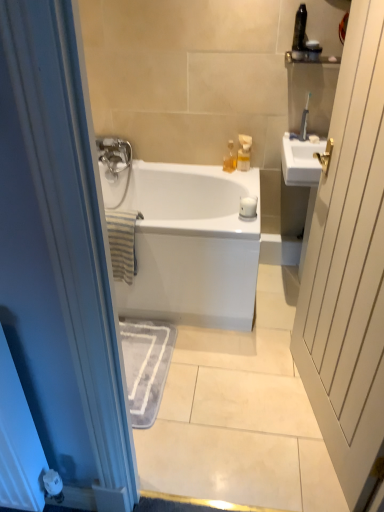
Question: From a real-world perspective, is white wood door at right below translucent plastic container at upper right, arranged as the fourth toiletry when viewed from the left?

Choices:
 (A) yes
 (B) no

Answer: (A)

Question: Does white wood door at right appear on the left side of translucent plastic container at upper right, arranged as the fourth toiletry when viewed from the left?

Choices:
 (A) yes
 (B) no

Answer: (A)

Question: Are white wood door at right and translucent plastic container at upper right, which appears as the 2th toiletry when viewed from the right, beside each other?

Choices:
 (A) no
 (B) yes

Answer: (A)

Question: Is white wood door at right positioned in front of translucent plastic container at upper right, which appears as the 2th toiletry when viewed from the right?

Choices:
 (A) no
 (B) yes

Answer: (B)

Question: Does white wood door at right have a lesser height compared to translucent plastic container at upper right, which appears as the 2th toiletry when viewed from the right?

Choices:
 (A) yes
 (B) no

Answer: (B)

Question: From the image's perspective, relative to translucent plastic bottle at upper center, which is the 1th toiletry in left-to-right order, is white wood door at right above or below?

Choices:
 (A) above
 (B) below

Answer: (B)

Question: In terms of height, does white wood door at right look taller or shorter compared to translucent plastic bottle at upper center, which is the 1th toiletry in left-to-right order?

Choices:
 (A) tall
 (B) short

Answer: (A)

Question: Choose the correct answer: Is white wood door at right inside translucent plastic bottle at upper center, which is the 1th toiletry in left-to-right order, or outside it?

Choices:
 (A) outside
 (B) inside

Answer: (A)

Question: Relative to translucent plastic bottle at upper center, which is the 5th toiletry from right to left, is white wood door at right in front or behind?

Choices:
 (A) behind
 (B) front

Answer: (B)

Question: In terms of size, does metallic gray toothbrush at upper right, which is the 1th toiletry from right to left, appear bigger or smaller than translucent plastic soap dispenser at upper center, which ranks as the 4th toiletry in right-to-left order?

Choices:
 (A) big
 (B) small

Answer: (B)

Question: Considering their positions, is metallic gray toothbrush at upper right, which is the 1th toiletry from right to left, located in front of or behind translucent plastic soap dispenser at upper center, which ranks as the 4th toiletry in right-to-left order?

Choices:
 (A) front
 (B) behind

Answer: (A)

Question: Is point (301, 123) positioned closer to the camera than point (248, 159)?

Choices:
 (A) closer
 (B) farther

Answer: (A)

Question: Considering the positions of metallic gray toothbrush at upper right, which is the fifth toiletry from left to right, and translucent plastic soap dispenser at upper center, which ranks as the 4th toiletry in right-to-left order, in the image, is metallic gray toothbrush at upper right, which is the fifth toiletry from left to right, taller or shorter than translucent plastic soap dispenser at upper center, which ranks as the 4th toiletry in right-to-left order,?

Choices:
 (A) tall
 (B) short

Answer: (A)

Question: Is translucent plastic soap dispenser at upper center, acting as the second toiletry starting from the left, bigger or smaller than translucent plastic bottle at upper center, which is the 1th toiletry in left-to-right order?

Choices:
 (A) small
 (B) big

Answer: (B)

Question: From a real-world perspective, is translucent plastic soap dispenser at upper center, which ranks as the 4th toiletry in right-to-left order, above or below translucent plastic bottle at upper center, which is the 1th toiletry in left-to-right order?

Choices:
 (A) above
 (B) below

Answer: (A)